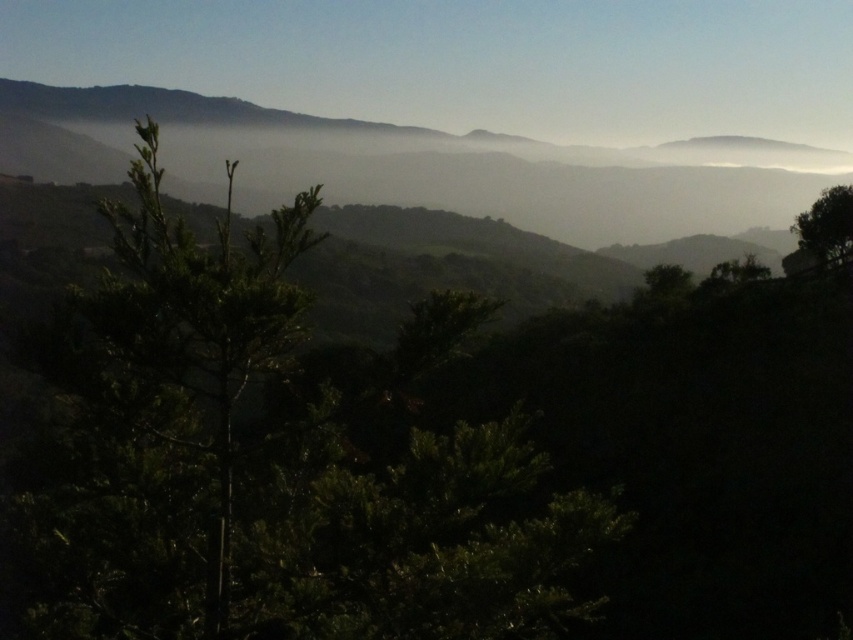
You are an artist planning to paint this landscape. You want to ensure the silvery misty mountain at upper center and the green leafy tree at right are proportionally accurate. Which object should you make wider in your painting?

The silvery misty mountain at upper center should be made wider in the painting since its width is larger than the green leafy tree at right according to the description.

You are a hiker planning to hike from the green leafy tree at right to the silvery misty mountain at upper center. What is the approximate distance you need to cover?

The silvery misty mountain at upper center and green leafy tree at right are 302.82 meters apart from each other, so you need to cover approximately 302.82 meters.

Based on the photo, you are standing in the valley and want to take a photo of both the green matte tree at center and the green leafy tree at right. Which tree should you focus on first if you want to include both in the frame without moving the camera?

You should focus on the green matte tree at center first because it is larger and closer to you compared to the green leafy tree at right, ensuring both can fit in the frame by adjusting the zoom.